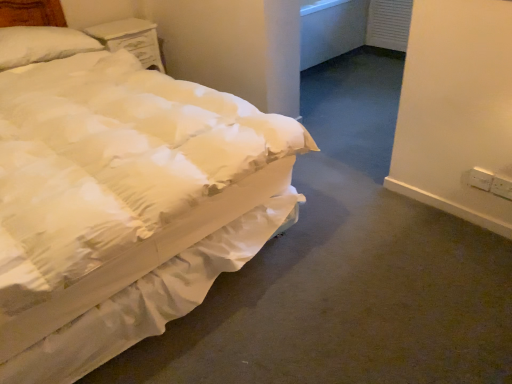
Question: From the image's perspective, is white plastic electric outlet at right, placed as the first electric outlet when sorted from left to right, positioned above or below white painted wood nightstand at upper left?

Choices:
 (A) below
 (B) above

Answer: (A)

Question: Visually, is white plastic electric outlet at right, arranged as the second electric outlet when viewed from the right, positioned to the left or to the right of white painted wood nightstand at upper left?

Choices:
 (A) right
 (B) left

Answer: (A)

Question: Which of these objects is positioned farthest from the white soft pillow at upper left?

Choices:
 (A) white quilted fabric bed at left
 (B) white plastic electric outlet at right, placed as the first electric outlet when sorted from left to right
 (C) white plastic electric outlet at lower right, which ranks as the second electric outlet in left-to-right order
 (D) white painted wood nightstand at upper left

Answer: (C)

Question: Estimate the real-world distances between objects in this image. Which object is farther from the white painted wood nightstand at upper left?

Choices:
 (A) white soft pillow at upper left
 (B) white plastic electric outlet at lower right, which is the first electric outlet in right-to-left order
 (C) white plastic electric outlet at right, placed as the first electric outlet when sorted from left to right
 (D) white quilted fabric bed at left

Answer: (B)